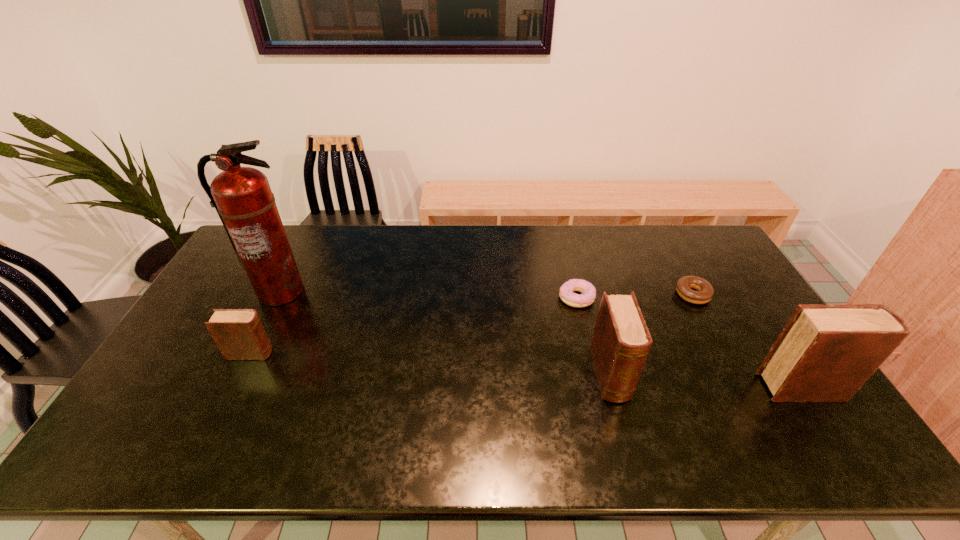
Identify which object is located as the fifth nearest to the second tallest diary. Please provide its 2D coordinates. Your answer should be formatted as a tuple, i.e. [(x, y)], where the tuple contains the x and y coordinates of a point satisfying the conditions above.

[(239, 334)]

I want to click on object that is the fourth closest to the left doughnut, so click(x=242, y=197).

Select which diary appears as the closest to the fourth shortest object. Please provide its 2D coordinates. Your answer should be formatted as a tuple, i.e. [(x, y)], where the tuple contains the x and y coordinates of a point satisfying the conditions above.

[(825, 353)]

Where is `diary that can be found as the closest to the shortest diary`? diary that can be found as the closest to the shortest diary is located at coordinates (621, 342).

The width and height of the screenshot is (960, 540). Identify the location of vacant area that satisfies the following two spatial constraints: 1. on the side of the fire extinguisher with the handle and hose; 2. on the left side of the right doughnut. (278, 294).

Find the location of a particular element. vacant area in the image that satisfies the following two spatial constraints: 1. on the side of the left doughnut with the handle and hose; 2. on the left side of the fire extinguisher is located at coordinates (276, 298).

This screenshot has width=960, height=540. In order to click on blank space that satisfies the following two spatial constraints: 1. on the side of the fire extinguisher with the handle and hose; 2. on the left side of the left doughnut in this screenshot , I will do `click(276, 298)`.